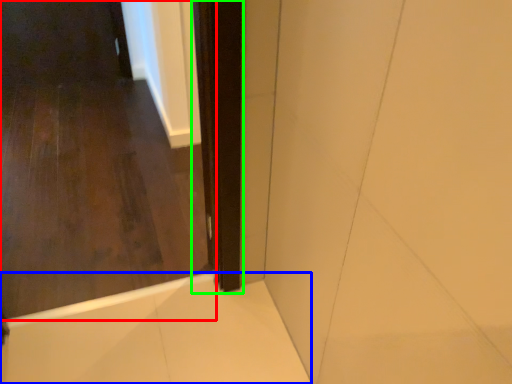
Question: Based on their relative distances, which object is farther from door (highlighted by a red box)? Choose from bath (highlighted by a blue box) and screen door (highlighted by a green box).

Choices:
 (A) bath
 (B) screen door

Answer: (B)